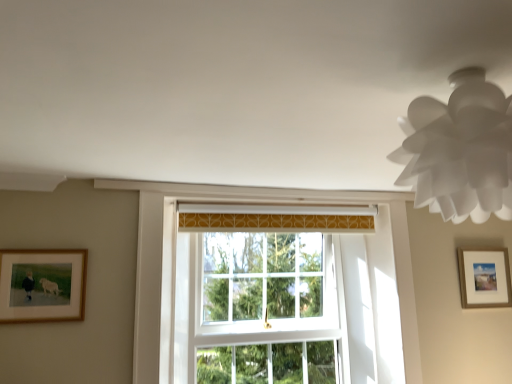
Describe the element at coordinates (266, 309) in the screenshot. I see `white glass window at center` at that location.

Describe the element at coordinates (460, 150) in the screenshot. I see `white paper lampshade at upper right` at that location.

The height and width of the screenshot is (384, 512). Find the location of `wooden framed picture at right, the 1th picture frame positioned from the right`. wooden framed picture at right, the 1th picture frame positioned from the right is located at coordinates (484, 278).

Locate an element on the screen. The image size is (512, 384). white glass window at center is located at coordinates (266, 309).

Which of these two, white paper lampshade at upper right or wooden framed picture at right, the 1th picture frame positioned from the right, is bigger?

With larger size is white paper lampshade at upper right.

Is the surface of white paper lampshade at upper right in direct contact with wooden framed picture at right, the 1th picture frame positioned from the right?

There is a gap between white paper lampshade at upper right and wooden framed picture at right, the 1th picture frame positioned from the right.

Is white paper lampshade at upper right inside or outside of wooden framed picture at right, the first picture frame when ordered from back to front?

white paper lampshade at upper right is not enclosed by wooden framed picture at right, the first picture frame when ordered from back to front.

Are white glass window at center and wooden framed picture at right, the 1th picture frame positioned from the right, located far from each other?

Yes, white glass window at center is far from wooden framed picture at right, the 1th picture frame positioned from the right.

The width and height of the screenshot is (512, 384). I want to click on bay window that is on the left side of wooden framed picture at right, the 1th picture frame positioned from the right, so click(x=266, y=309).

From the picture: How many degrees apart are the facing directions of white glass window at center and wooden framed picture at right, positioned as the 2th picture frame in front-to-back order?

The angle between the facing direction of white glass window at center and the facing direction of wooden framed picture at right, positioned as the 2th picture frame in front-to-back order, is 1.43 degrees.

From their relative heights in the image, would you say white glass window at center is taller or shorter than wooden framed picture at right, positioned as the 2th picture frame in front-to-back order?

white glass window at center is taller than wooden framed picture at right, positioned as the 2th picture frame in front-to-back order.

Which is farther, (x=1, y=287) or (x=462, y=167)?

The point (x=1, y=287) is farther from the camera.

You are a GUI agent. You are given a task and a screenshot of the screen. Output one action in this format:
    pyautogui.click(x=<x>, y=<y>)
    Task: Click on the picture frame lying on the left of white paper lampshade at upper right
    
    Given the screenshot: What is the action you would take?
    pyautogui.click(x=42, y=285)

Is wooden framed picture at left, acting as the 1th picture frame starting from the left, located outside white paper lampshade at upper right?

Yes, wooden framed picture at left, acting as the 1th picture frame starting from the left, is outside of white paper lampshade at upper right.

Could you tell me if wooden framed picture at left, placed as the 2th picture frame when sorted from right to left, is facing white paper lampshade at upper right?

No, wooden framed picture at left, placed as the 2th picture frame when sorted from right to left, does not turn towards white paper lampshade at upper right.

Is wooden framed picture at right, the first picture frame when ordered from back to front, not within white paper lampshade at upper right?

Absolutely, wooden framed picture at right, the first picture frame when ordered from back to front, is external to white paper lampshade at upper right.

From a real-world perspective, is wooden framed picture at right, the first picture frame when ordered from back to front, over white paper lampshade at upper right?

No.

Is wooden framed picture at right, the second picture frame viewed from the left, taller than white paper lampshade at upper right?

Correct, wooden framed picture at right, the second picture frame viewed from the left, is much taller as white paper lampshade at upper right.

From a real-world perspective, is white glass window at center located beneath white paper lampshade at upper right?

Indeed, from a real-world perspective, white glass window at center is positioned beneath white paper lampshade at upper right.

In the scene shown: Is white paper lampshade at upper right inside white glass window at center?

Actually, white paper lampshade at upper right is outside white glass window at center.

From the picture: Which object is closer to the camera, white glass window at center or white paper lampshade at upper right?

white paper lampshade at upper right is closer to the camera.

Is white glass window at center directly adjacent to white paper lampshade at upper right?

No, white glass window at center is not next to white paper lampshade at upper right.

Which object is more forward, white paper lampshade at upper right or wooden framed picture at left, acting as the second picture frame starting from the back?

white paper lampshade at upper right is closer to the camera.

Is white paper lampshade at upper right far from wooden framed picture at left, which is the first picture frame in front-to-back order?

Yes, white paper lampshade at upper right and wooden framed picture at left, which is the first picture frame in front-to-back order, are located far from each other.

Is white paper lampshade at upper right turned away from wooden framed picture at left, acting as the second picture frame starting from the back?

No, white paper lampshade at upper right is not facing away from wooden framed picture at left, acting as the second picture frame starting from the back.

Can you confirm if white paper lampshade at upper right is wider than wooden framed picture at left, acting as the second picture frame starting from the back?

Indeed, white paper lampshade at upper right has a greater width compared to wooden framed picture at left, acting as the second picture frame starting from the back.

I want to click on picture frame above the wooden framed picture at right, the first picture frame when ordered from back to front (from the image's perspective), so click(x=42, y=285).

Can we say wooden framed picture at right, the 1th picture frame positioned from the right, lies outside wooden framed picture at left, placed as the 2th picture frame when sorted from right to left?

wooden framed picture at right, the 1th picture frame positioned from the right, is positioned outside wooden framed picture at left, placed as the 2th picture frame when sorted from right to left.

Considering the sizes of wooden framed picture at right, the second picture frame viewed from the left, and wooden framed picture at left, placed as the 2th picture frame when sorted from right to left, in the image, is wooden framed picture at right, the second picture frame viewed from the left, wider or thinner than wooden framed picture at left, placed as the 2th picture frame when sorted from right to left,?

Considering their sizes, wooden framed picture at right, the second picture frame viewed from the left, looks broader than wooden framed picture at left, placed as the 2th picture frame when sorted from right to left.

Considering the relative positions of wooden framed picture at right, positioned as the 2th picture frame in front-to-back order, and wooden framed picture at left, acting as the 1th picture frame starting from the left, in the image provided, is wooden framed picture at right, positioned as the 2th picture frame in front-to-back order, to the right of wooden framed picture at left, acting as the 1th picture frame starting from the left, from the viewer's perspective?

Yes, wooden framed picture at right, positioned as the 2th picture frame in front-to-back order, is to the right of wooden framed picture at left, acting as the 1th picture frame starting from the left.

I want to click on lamp above the wooden framed picture at right, the first picture frame when ordered from back to front (from the image's perspective), so click(x=460, y=150).

Identify the location of picture frame behind the white glass window at center. (484, 278).

When comparing their distances from wooden framed picture at left, acting as the 1th picture frame starting from the left, does white paper lampshade at upper right or white glass window at center seem further?

Based on the image, white paper lampshade at upper right appears to be further to wooden framed picture at left, acting as the 1th picture frame starting from the left.

Based on their spatial positions, is wooden framed picture at left, acting as the second picture frame starting from the back, or white glass window at center further from white paper lampshade at upper right?

white glass window at center lies further to white paper lampshade at upper right than the other object.

Looking at the image, which one is located further to wooden framed picture at left, which is the first picture frame in front-to-back order, wooden framed picture at right, the first picture frame when ordered from back to front, or white glass window at center?

wooden framed picture at right, the first picture frame when ordered from back to front.

Considering their positions, is white glass window at center positioned further to wooden framed picture at left, placed as the 2th picture frame when sorted from right to left, than white paper lampshade at upper right?

The object further to wooden framed picture at left, placed as the 2th picture frame when sorted from right to left, is white paper lampshade at upper right.

Considering their positions, is white paper lampshade at upper right positioned closer to wooden framed picture at right, the first picture frame when ordered from back to front, than white glass window at center?

white glass window at center.

Considering their positions, is wooden framed picture at right, positioned as the 2th picture frame in front-to-back order, positioned further to white paper lampshade at upper right than white glass window at center?

Among the two, wooden framed picture at right, positioned as the 2th picture frame in front-to-back order, is located further to white paper lampshade at upper right.

From the image, which object appears to be farther from white glass window at center, wooden framed picture at right, the 1th picture frame positioned from the right, or wooden framed picture at left, placed as the 2th picture frame when sorted from right to left?

wooden framed picture at right, the 1th picture frame positioned from the right.

Estimate the real-world distances between objects in this image. Which object is further from white glass window at center, wooden framed picture at left, which is the first picture frame in front-to-back order, or wooden framed picture at right, the 1th picture frame positioned from the right?

wooden framed picture at right, the 1th picture frame positioned from the right, is positioned further to the anchor white glass window at center.

Identify the location of bay window between white paper lampshade at upper right and wooden framed picture at right, the second picture frame viewed from the left, in the front-back direction. (266, 309).

This screenshot has height=384, width=512. I want to click on bay window between wooden framed picture at left, acting as the 1th picture frame starting from the left, and wooden framed picture at right, the 1th picture frame positioned from the right, in the horizontal direction, so click(266, 309).

Where is `picture frame between white paper lampshade at upper right and white glass window at center in the front-back direction`? picture frame between white paper lampshade at upper right and white glass window at center in the front-back direction is located at coordinates click(x=42, y=285).

At what (x,y) coordinates should I click in order to perform the action: click on lamp between wooden framed picture at left, acting as the second picture frame starting from the back, and wooden framed picture at right, the second picture frame viewed from the left, in the horizontal direction. Please return your answer as a coordinate pair (x, y). The image size is (512, 384). Looking at the image, I should click on (460, 150).